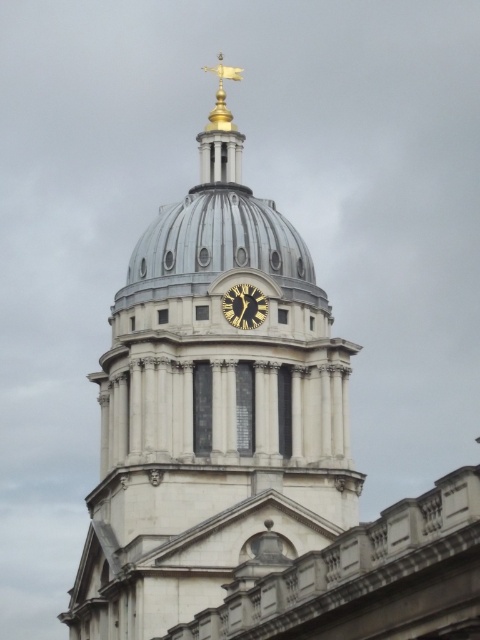
Is white stone dome at center below gold metallic clock at center?

Yes.

Is white stone dome at center to the left of gold metallic clock at center from the viewer's perspective?

Correct, you'll find white stone dome at center to the left of gold metallic clock at center.

What do you see at coordinates (212, 420) in the screenshot? I see `white stone dome at center` at bounding box center [212, 420].

At what (x,y) coordinates should I click in order to perform the action: click on white stone dome at center. Please return your answer as a coordinate pair (x, y). The width and height of the screenshot is (480, 640). Looking at the image, I should click on (212, 420).

Can you confirm if white stone dome at center is shorter than gold polished metal weather vane at upper center?

Incorrect, white stone dome at center's height does not fall short of gold polished metal weather vane at upper center's.

Describe the element at coordinates (212, 420) in the screenshot. I see `white stone dome at center` at that location.

Where is `white stone dome at center`? This screenshot has height=640, width=480. white stone dome at center is located at coordinates (212, 420).

Based on the photo, is gold polished metal weather vane at upper center to the right of gold metallic clock at center from the viewer's perspective?

In fact, gold polished metal weather vane at upper center is to the left of gold metallic clock at center.

Identify the location of gold polished metal weather vane at upper center. The width and height of the screenshot is (480, 640). (220, 132).